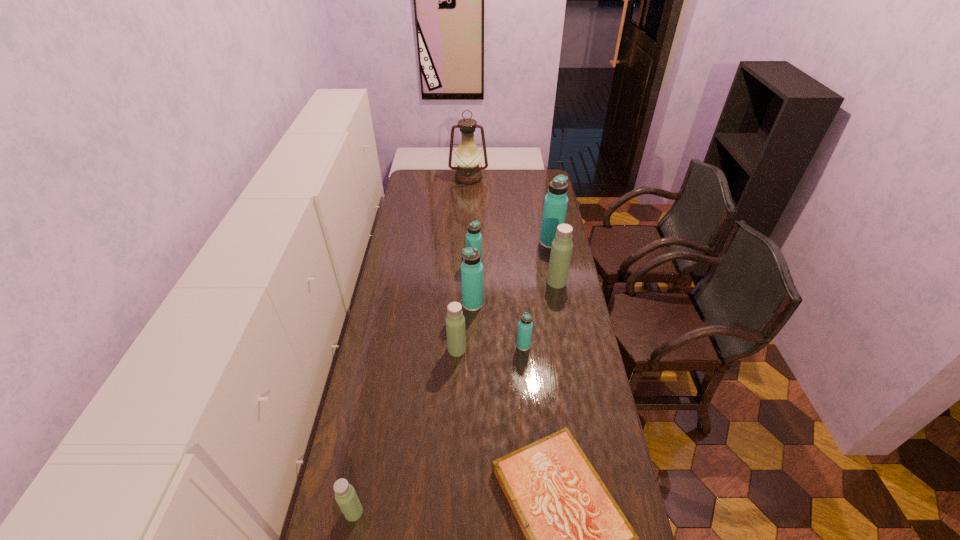
I want to click on aqua thermos bottle that can be found as the second closest to the sixth nearest thermos bottle, so click(555, 204).

Where is `light thermos bottle that is the second closest one to the farthest light thermos bottle`? This screenshot has height=540, width=960. light thermos bottle that is the second closest one to the farthest light thermos bottle is located at coordinates click(x=345, y=495).

Locate an element on the screen. This screenshot has height=540, width=960. light thermos bottle identified as the second closest to the farthest aqua thermos bottle is located at coordinates (455, 321).

Locate an element on the screen. Image resolution: width=960 pixels, height=540 pixels. free space that satisfies the following two spatial constraints: 1. on the back side of the third nearest aqua thermos bottle; 2. on the left side of the second nearest light thermos bottle is located at coordinates (461, 265).